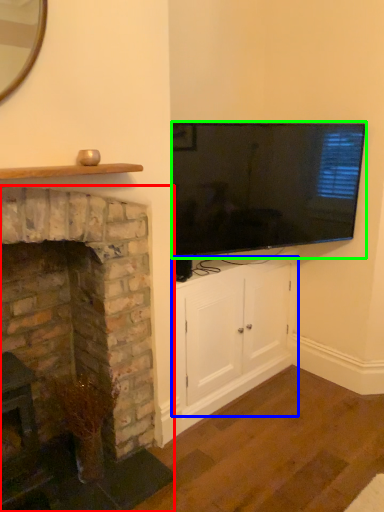
Question: Based on their relative distances, which object is farther from fireplace (highlighted by a red box)? Choose from cabinetry (highlighted by a blue box) and television (highlighted by a green box).

Choices:
 (A) cabinetry
 (B) television

Answer: (B)